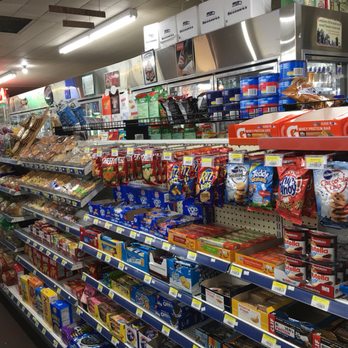
The width and height of the screenshot is (348, 348). I want to click on jars of nutella, so click(x=291, y=245), click(x=293, y=273), click(x=322, y=279), click(x=326, y=253).